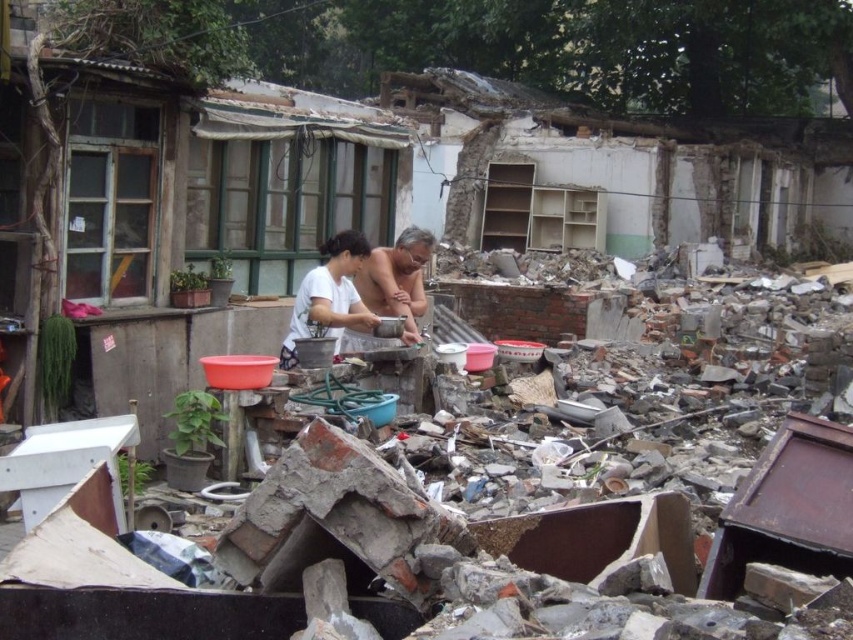
Question: Which of the following is the closest to the observer?

Choices:
 (A) smooth skin man at center
 (B) white matte shirt at center

Answer: (B)

Question: Is white matte shirt at center positioned behind smooth skin man at center?

Choices:
 (A) no
 (B) yes

Answer: (A)

Question: Is white matte shirt at center above smooth skin man at center?

Choices:
 (A) no
 (B) yes

Answer: (A)

Question: Where is white matte shirt at center located in relation to smooth skin man at center in the image?

Choices:
 (A) right
 (B) left

Answer: (B)